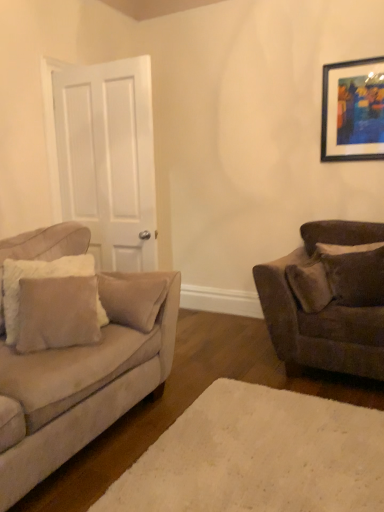
Question: Based on their sizes in the image, would you say velvet brown couch at right, the 2th studio couch from the left, is bigger or smaller than white matte door at left?

Choices:
 (A) small
 (B) big

Answer: (B)

Question: Choose the correct answer: Is velvet brown couch at right, the 2th studio couch from the left, inside white matte door at left or outside it?

Choices:
 (A) outside
 (B) inside

Answer: (A)

Question: Estimate the real-world distances between objects in this image. Which object is farther from the wooden-framed artwork at upper right?

Choices:
 (A) suede-like brown pillow at right, the second pillow positioned from the front
 (B) suede beige couch at left, which is the first studio couch in left-to-right order
 (C) velvet brown couch at right, the 2th studio couch from the left
 (D) white matte door at left
 (E) beige fabric pillow at left, the 1th pillow in the left-to-right sequence

Answer: (E)

Question: Which object is positioned closest to the white matte door at left?

Choices:
 (A) white plush rug at lower center
 (B) velvet brown couch at right, the 2th studio couch from the left
 (C) wooden-framed artwork at upper right
 (D) beige fabric pillow at left, positioned as the 1th pillow in front-to-back order
 (E) suede-like brown pillow at right, which is counted as the 1th pillow, starting from the right

Answer: (D)